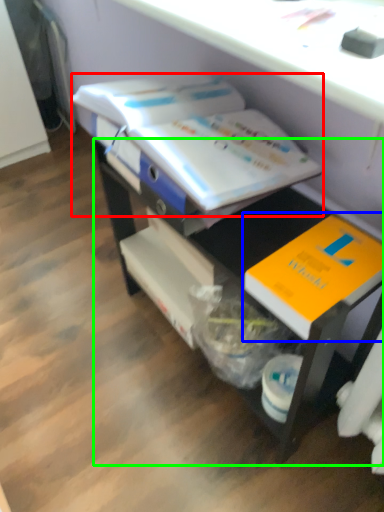
Question: Estimate the real-world distances between objects in this image. Which object is farther from book (highlighted by a red box), book (highlighted by a blue box) or desk (highlighted by a green box)?

Choices:
 (A) book
 (B) desk

Answer: (A)